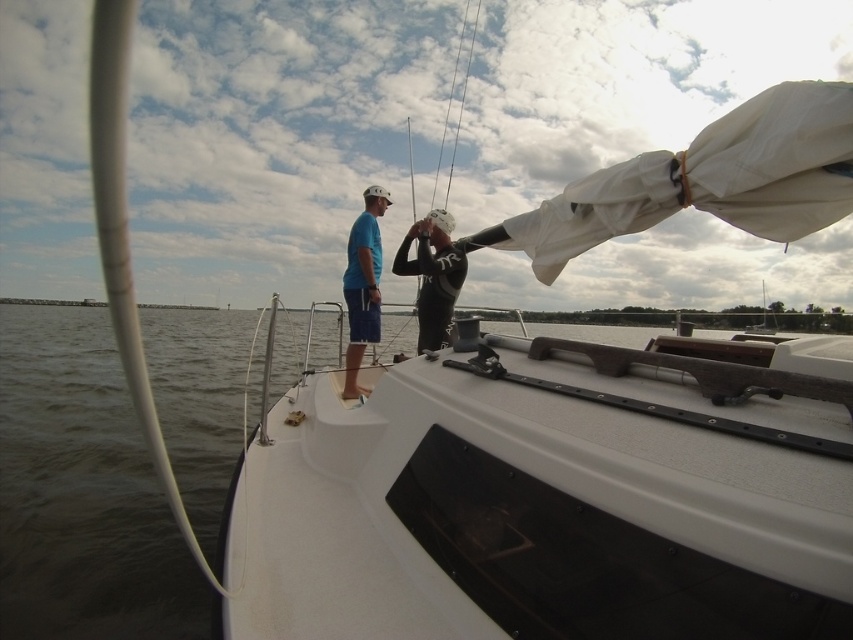
Question: Where is transparent water at center located in relation to matte blue shorts at center in the image?

Choices:
 (A) right
 (B) left

Answer: (B)

Question: Which point appears farthest from the camera in this image?

Choices:
 (A) (451, 257)
 (B) (677, 582)

Answer: (A)

Question: Does transparent water at center have a larger size compared to black rubber wetsuit at center?

Choices:
 (A) no
 (B) yes

Answer: (B)

Question: Which point is farther from the camera taking this photo?

Choices:
 (A) (347, 353)
 (B) (422, 253)

Answer: (A)

Question: Is transparent water at center to the left of matte blue shorts at center from the viewer's perspective?

Choices:
 (A) no
 (B) yes

Answer: (B)

Question: Which object is positioned closest to the black rubber wetsuit at center?

Choices:
 (A) transparent water at center
 (B) matte blue shorts at center

Answer: (B)